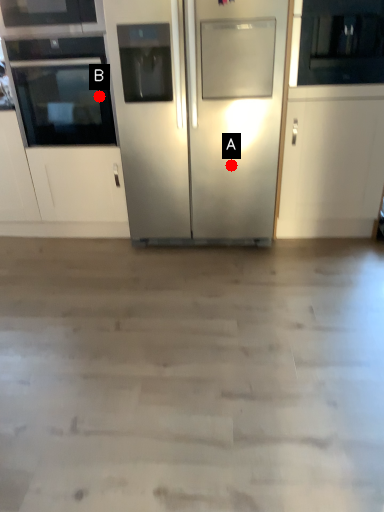
Question: Two points are circled on the image, labeled by A and B beside each circle. Which point appears closest to the camera in this image?

Choices:
 (A) A is closer
 (B) B is closer

Answer: (A)